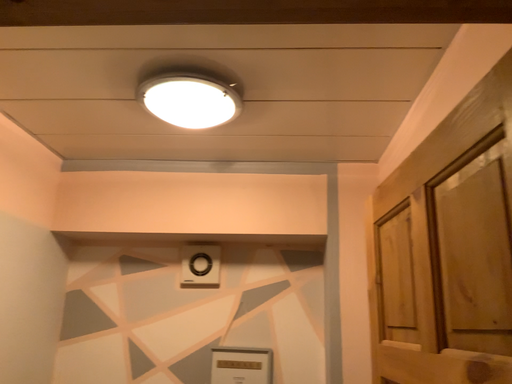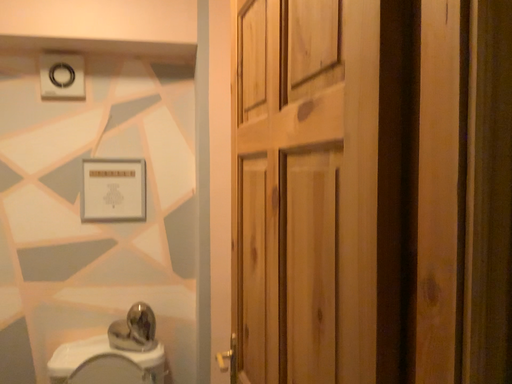
Question: How did the camera likely rotate when shooting the video?

Choices:
 (A) rotated downward
 (B) rotated upward

Answer: (A)